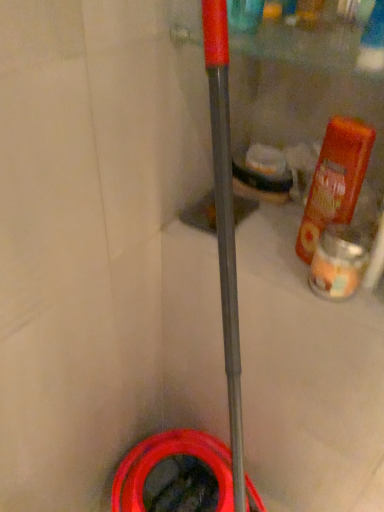
Measure the distance between orange matte bottle at right and camera.

orange matte bottle at right is 20.83 inches away from camera.

Where is `orange matte bottle at right`? orange matte bottle at right is located at coordinates 335,181.

Considering the relative positions of translucent glass candle at right and rubber/matte garden hose at lower center in the image provided, is translucent glass candle at right to the right of rubber/matte garden hose at lower center from the viewer's perspective?

Yes, translucent glass candle at right is to the right of rubber/matte garden hose at lower center.

The width and height of the screenshot is (384, 512). In order to click on garden hose that appears behind the translucent glass candle at right in this screenshot , I will do `click(167, 457)`.

Would you consider translucent glass candle at right to be distant from rubber/matte garden hose at lower center?

translucent glass candle at right is actually quite close to rubber/matte garden hose at lower center.

Looking at this image, from the image's perspective, which object appears higher, translucent glass candle at right or rubber/matte garden hose at lower center?

translucent glass candle at right appears higher in the image.

Between point (176, 443) and point (340, 231), which one is positioned behind?

The point (176, 443) is behind.

Is rubber/matte garden hose at lower center beside translucent glass candle at right?

rubber/matte garden hose at lower center and translucent glass candle at right are not in contact.

From the image's perspective, would you say rubber/matte garden hose at lower center is shown under translucent glass candle at right?

Yes, from the image's perspective, rubber/matte garden hose at lower center is beneath translucent glass candle at right.

Choose the correct answer: Is orange matte bottle at right inside rubber/matte garden hose at lower center or outside it?

The correct answer is: outside.

Considering the relative sizes of orange matte bottle at right and rubber/matte garden hose at lower center in the image provided, is orange matte bottle at right taller than rubber/matte garden hose at lower center?

No, orange matte bottle at right is not taller than rubber/matte garden hose at lower center.

The width and height of the screenshot is (384, 512). Identify the location of garden hose lying on the left of orange matte bottle at right. (167, 457).

In the scene shown: From the image's perspective, who appears lower, orange matte bottle at right or rubber/matte garden hose at lower center?

rubber/matte garden hose at lower center is shown below in the image.

Are rubber/matte garden hose at lower center and orange matte bottle at right making contact?

No, rubber/matte garden hose at lower center is not in contact with orange matte bottle at right.

Looking at this image, can you tell me how much rubber/matte garden hose at lower center and orange matte bottle at right differ in facing direction?

The facing directions of rubber/matte garden hose at lower center and orange matte bottle at right are 95.5 degrees apart.

Is rubber/matte garden hose at lower center in front of orange matte bottle at right?

No, rubber/matte garden hose at lower center is further to the viewer.

Would you say orange matte bottle at right is part of translucent glass candle at right's contents?

No, translucent glass candle at right does not contain orange matte bottle at right.

How different are the orientations of translucent glass candle at right and orange matte bottle at right in degrees?

The facing directions of translucent glass candle at right and orange matte bottle at right are 11.4 degrees apart.

From the image's perspective, which one is positioned higher, translucent glass candle at right or orange matte bottle at right?

orange matte bottle at right, from the image's perspective.

From the image's perspective, is orange matte bottle at right positioned above or below translucent glass candle at right?

Based on their image positions, orange matte bottle at right is located above translucent glass candle at right.

Is there a large distance between orange matte bottle at right and translucent glass candle at right?

No.

Can you confirm if orange matte bottle at right is wider than translucent glass candle at right?

In fact, orange matte bottle at right might be narrower than translucent glass candle at right.

Find the location of `cleaning product that appears below the orange matte bottle at right (from a real-world perspective)`. cleaning product that appears below the orange matte bottle at right (from a real-world perspective) is located at coordinates (339, 262).

Find the location of a particular element. The width and height of the screenshot is (384, 512). cleaning product that is in front of the rubber/matte garden hose at lower center is located at coordinates (339, 262).

Where is `cleaning product above the rubber/matte garden hose at lower center (from a real-world perspective)`? This screenshot has height=512, width=384. cleaning product above the rubber/matte garden hose at lower center (from a real-world perspective) is located at coordinates 339,262.

Estimate the real-world distances between objects in this image. Which object is closer to translucent glass candle at right, orange matte bottle at right or rubber/matte garden hose at lower center?

orange matte bottle at right is positioned closer to the anchor translucent glass candle at right.

Estimate the real-world distances between objects in this image. Which object is further from orange matte bottle at right, rubber/matte garden hose at lower center or translucent glass candle at right?

Among the two, rubber/matte garden hose at lower center is located further to orange matte bottle at right.

Consider the image. Estimate the real-world distances between objects in this image. Which object is further from rubber/matte garden hose at lower center, orange matte bottle at right or translucent glass candle at right?

The object further to rubber/matte garden hose at lower center is orange matte bottle at right.

Consider the image. Considering their positions, is translucent glass candle at right positioned closer to rubber/matte garden hose at lower center than orange matte bottle at right?

translucent glass candle at right is positioned closer to the anchor rubber/matte garden hose at lower center.

Looking at the image, which one is located further to orange matte bottle at right, translucent glass candle at right or rubber/matte garden hose at lower center?

Based on the image, rubber/matte garden hose at lower center appears to be further to orange matte bottle at right.

In the scene shown: When comparing their distances from translucent glass candle at right, does rubber/matte garden hose at lower center or orange matte bottle at right seem further?

rubber/matte garden hose at lower center lies further to translucent glass candle at right than the other object.

You are a GUI agent. You are given a task and a screenshot of the screen. Output one action in this format:
    pyautogui.click(x=<x>, y=<y>)
    Task: Click on the cleaning product between orange matte bottle at right and rubber/matte garden hose at lower center in the up-down direction
    
    Given the screenshot: What is the action you would take?
    pyautogui.click(x=339, y=262)